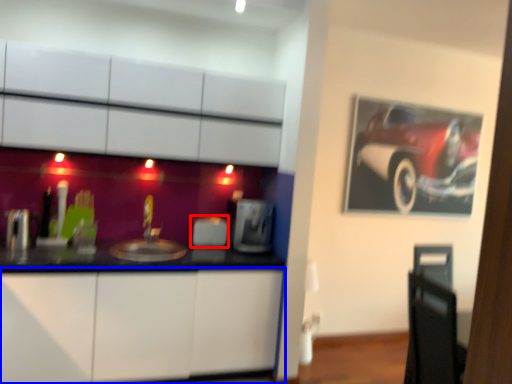
Question: Which of the following is the farthest to the observer, appliance (highlighted by a red box) or cabinetry (highlighted by a blue box)?

Choices:
 (A) appliance
 (B) cabinetry

Answer: (A)